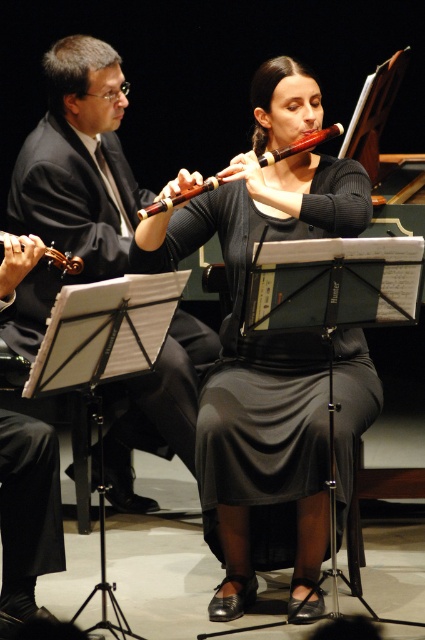
Question: Which point is closer to the camera?

Choices:
 (A) (96, 260)
 (B) (164, 209)
 (C) (365, 384)
 (D) (2, 236)

Answer: (D)

Question: Which point is farther to the camera?

Choices:
 (A) (311, 148)
 (B) (98, 259)
 (C) (57, 257)

Answer: (B)

Question: Does matte black flute at center appear on the left side of wooden flute at center?

Choices:
 (A) yes
 (B) no

Answer: (B)

Question: Does wooden flute at center appear over brushed metal violin at left?

Choices:
 (A) no
 (B) yes

Answer: (B)

Question: Which point is closer to the camera?

Choices:
 (A) wooden flute at center
 (B) brushed metal violin at left
 (C) matte black flute at center
 (D) matte black suit at left

Answer: (A)

Question: Is matte black flute at center positioned at the back of brushed metal violin at left?

Choices:
 (A) no
 (B) yes

Answer: (B)